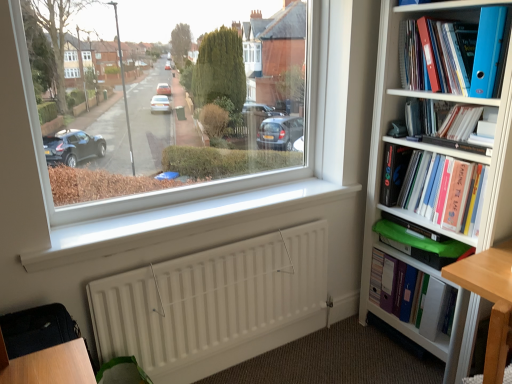
Question: Does hardcover book at upper right, positioned as the second book in top-to-bottom order, have a lesser width compared to white plastic shelf at lower right?

Choices:
 (A) no
 (B) yes

Answer: (A)

Question: Is hardcover book at upper right, placed as the third book when sorted from bottom to top, wider than white plastic shelf at lower right?

Choices:
 (A) no
 (B) yes

Answer: (B)

Question: Considering the relative positions of hardcover book at upper right, positioned as the second book in top-to-bottom order, and white plastic shelf at lower right in the image provided, is hardcover book at upper right, positioned as the second book in top-to-bottom order, to the right of white plastic shelf at lower right from the viewer's perspective?

Choices:
 (A) no
 (B) yes

Answer: (B)

Question: Considering the relative positions of hardcover book at upper right, positioned as the second book in top-to-bottom order, and white plastic shelf at lower right in the image provided, is hardcover book at upper right, positioned as the second book in top-to-bottom order, to the left of white plastic shelf at lower right from the viewer's perspective?

Choices:
 (A) yes
 (B) no

Answer: (B)

Question: Considering the relative sizes of hardcover book at upper right, positioned as the second book in top-to-bottom order, and white plastic shelf at lower right in the image provided, is hardcover book at upper right, positioned as the second book in top-to-bottom order, smaller than white plastic shelf at lower right?

Choices:
 (A) no
 (B) yes

Answer: (A)

Question: In the image, is white matte radiator at lower center positioned in front of or behind white smooth window sill at center?

Choices:
 (A) behind
 (B) front

Answer: (A)

Question: Is point (247, 276) closer or farther from the camera than point (101, 218)?

Choices:
 (A) farther
 (B) closer

Answer: (A)

Question: Looking at the image, does white matte radiator at lower center seem bigger or smaller compared to white smooth window sill at center?

Choices:
 (A) small
 (B) big

Answer: (B)

Question: Considering the positions of white matte radiator at lower center and white smooth window sill at center in the image, is white matte radiator at lower center wider or thinner than white smooth window sill at center?

Choices:
 (A) wide
 (B) thin

Answer: (B)

Question: Choose the correct answer: Is hardcover book at upper right, positioned as the second book in top-to-bottom order, inside blue plastic folder at upper right or outside it?

Choices:
 (A) inside
 (B) outside

Answer: (B)

Question: In the image, is hardcover book at upper right, positioned as the second book in top-to-bottom order, positioned in front of or behind blue plastic folder at upper right?

Choices:
 (A) front
 (B) behind

Answer: (B)

Question: Considering the relative positions of hardcover book at upper right, positioned as the second book in top-to-bottom order, and blue plastic folder at upper right in the image provided, is hardcover book at upper right, positioned as the second book in top-to-bottom order, to the left or to the right of blue plastic folder at upper right?

Choices:
 (A) left
 (B) right

Answer: (B)

Question: Is point (476, 125) positioned closer to the camera than point (493, 34)?

Choices:
 (A) closer
 (B) farther

Answer: (B)

Question: From the image's perspective, relative to white smooth window sill at center, is hardcover book at upper right, placed as the third book when sorted from bottom to top, above or below?

Choices:
 (A) below
 (B) above

Answer: (B)

Question: Considering the relative positions of hardcover book at upper right, positioned as the second book in top-to-bottom order, and white smooth window sill at center in the image provided, is hardcover book at upper right, positioned as the second book in top-to-bottom order, to the left or to the right of white smooth window sill at center?

Choices:
 (A) right
 (B) left

Answer: (A)